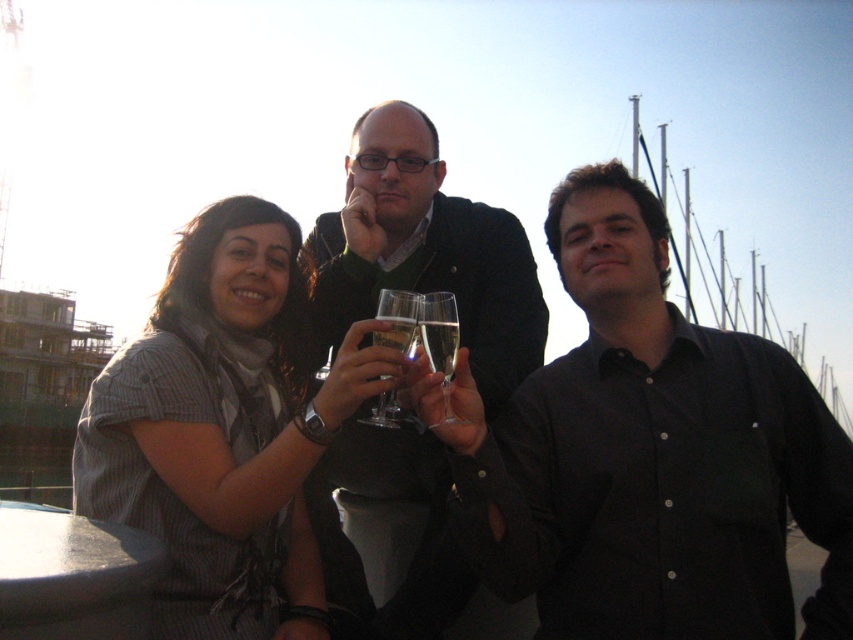
You are a photographer at the event and want to capture a photo that includes both the striped fabric shirt at center and the clear glass at center. Which object should you focus on first to ensure both are in frame?

The striped fabric shirt at center is below the clear glass at center, so you should focus on the clear glass at center first to ensure both are in frame.